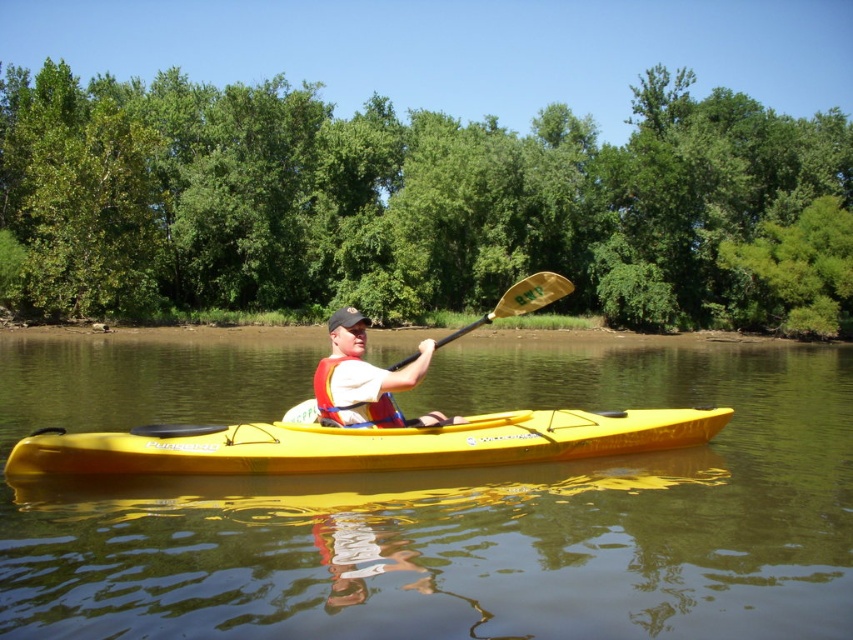
You are a drone operator trying to capture the kayak from above. The kayak is at the center of the image. There is a point at coordinates (361, 444). Is this point located on the yellow matte kayak at center?

Yes, the point at coordinates (361, 444) is located on the yellow matte kayak at center.

You are a photographer trying to capture the yellow matte kayak at center and the red life jacket at center in a single shot. Which object will appear larger in your photo?

The yellow matte kayak at center will appear larger in the photo because it is closer to the viewer than the red life jacket at center.

You are a photographer trying to capture the gold textured paddle at center and the matte white life vest at center in a single shot. Since both are at the center, how can you adjust your camera angle to ensure both are visible without one blocking the other?

The gold textured paddle at center is positioned over the matte white life vest at center. To capture both without obstruction, adjust the camera angle slightly downward to reveal the life vest underneath the paddle.